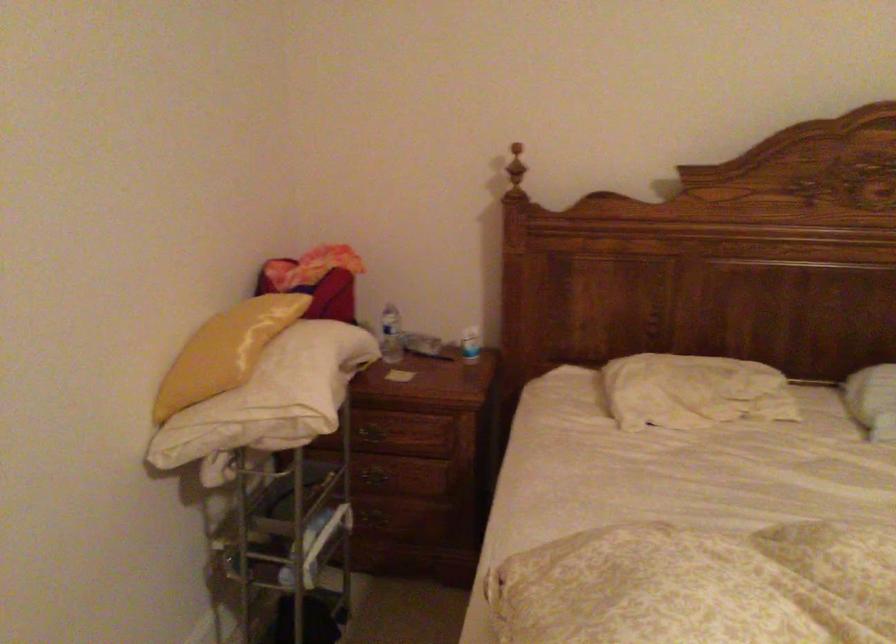
Which object does [470,344] point to?

This point indicates the small white bottle.